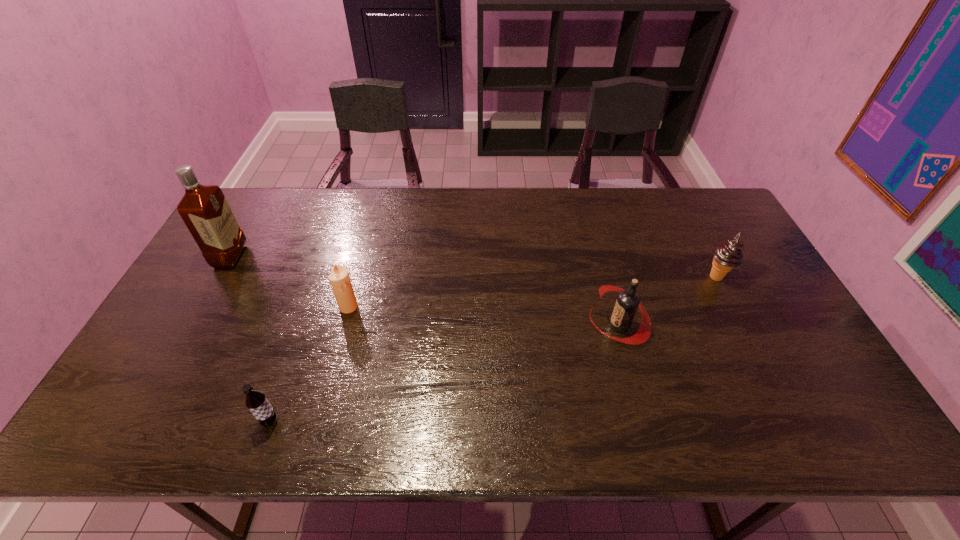
Locate an element on the screen. This screenshot has width=960, height=540. the tallest object is located at coordinates (204, 209).

This screenshot has width=960, height=540. What are the coordinates of `the leftmost object` in the screenshot? It's located at (204, 209).

Identify the location of the right root beer. The image size is (960, 540). (627, 302).

At what (x,y) coordinates should I click in order to perform the action: click on the taller root beer. Please return your answer as a coordinate pair (x, y). The width and height of the screenshot is (960, 540). Looking at the image, I should click on click(x=627, y=302).

Locate an element on the screen. This screenshot has width=960, height=540. candle is located at coordinates coord(339,278).

The height and width of the screenshot is (540, 960). I want to click on icecream, so [728, 255].

In order to click on the second object from left to right in this screenshot , I will do `click(255, 401)`.

Locate an element on the screen. This screenshot has width=960, height=540. the left root beer is located at coordinates (255, 401).

Find the location of a particular element. The height and width of the screenshot is (540, 960). vacant space situated 0.290m on the front label of the tallest object is located at coordinates pyautogui.click(x=336, y=256).

In order to click on free region located 0.360m on the label of the second object from right to left in this screenshot , I will do `click(457, 325)`.